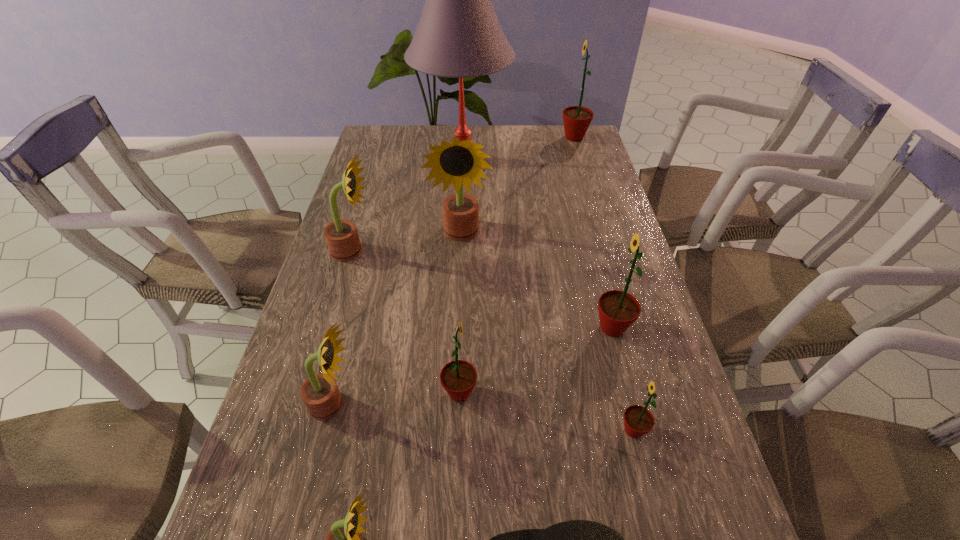
Find the location of `object that is the third nearest to the biggest yellow sunflower`. object that is the third nearest to the biggest yellow sunflower is located at coordinates (618, 310).

Identify which object is located as the fourth nearest to the nearest green sunflower. Please provide its 2D coordinates. Your answer should be formatted as a tuple, i.e. [(x, y)], where the tuple contains the x and y coordinates of a point satisfying the conditions above.

[(344, 539)]

At what (x,y) coordinates should I click in order to perform the action: click on the second closest sunflower to the black baseball cap. Please return your answer as a coordinate pair (x, y). The height and width of the screenshot is (540, 960). Looking at the image, I should click on (344, 539).

Identify the location of sunflower that is the third closest one to the third sunflower from left to right. This screenshot has width=960, height=540. (638, 420).

Locate an element on the screen. The width and height of the screenshot is (960, 540). the closest green sunflower relative to the leftmost green sunflower is located at coordinates (638, 420).

Select which green sunflower appears as the second closest to the smallest green sunflower. Please provide its 2D coordinates. Your answer should be formatted as a tuple, i.e. [(x, y)], where the tuple contains the x and y coordinates of a point satisfying the conditions above.

[(458, 377)]

Identify which yellow sunflower is the third closest to the second nearest green sunflower. Please provide its 2D coordinates. Your answer should be formatted as a tuple, i.e. [(x, y)], where the tuple contains the x and y coordinates of a point satisfying the conditions above.

[(342, 238)]

Image resolution: width=960 pixels, height=540 pixels. I want to click on yellow sunflower identified as the second closest to the second nearest green sunflower, so click(x=344, y=539).

I want to click on free space that satisfies the following two spatial constraints: 1. on the face of the farthest green sunflower; 2. on the front-facing side of the light table lamp, so click(581, 161).